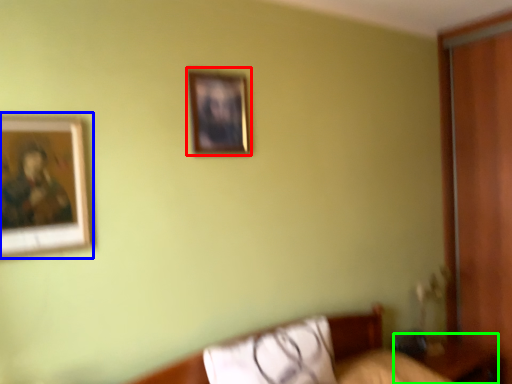
Question: Which object is the farthest from picture frame (highlighted by a red box)? Choose among these: picture frame (highlighted by a blue box) or table (highlighted by a green box).

Choices:
 (A) picture frame
 (B) table

Answer: (B)